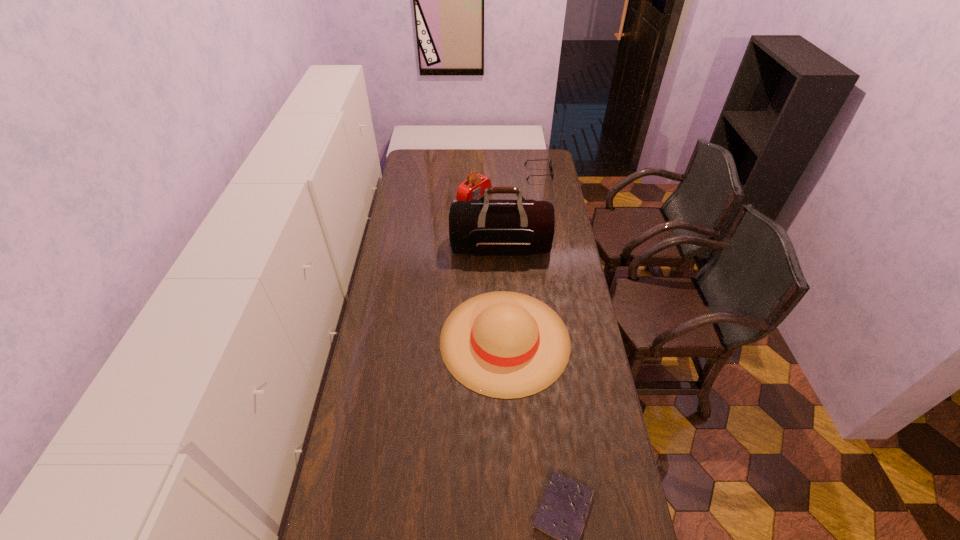
The image size is (960, 540). Identify the location of duffel bag. (483, 227).

Where is `the tallest object`? This screenshot has width=960, height=540. the tallest object is located at coordinates (483, 227).

Find the location of `the second nearest object`. the second nearest object is located at coordinates (502, 344).

You are a GUI agent. You are given a task and a screenshot of the screen. Output one action in this format:
    pyautogui.click(x=<x>, y=<y>)
    Task: Click on the fourth nearest object
    The image size is (960, 540).
    Given the screenshot: What is the action you would take?
    pyautogui.click(x=473, y=188)

Image resolution: width=960 pixels, height=540 pixels. In order to click on the fourth tallest object in this screenshot , I will do `click(551, 168)`.

The image size is (960, 540). I want to click on the farthest object, so click(x=551, y=168).

Locate an element on the screen. vacant position located 0.380m on the front pocket of the duffel bag is located at coordinates (505, 334).

Where is `vacant area located 0.150m on the front of the sombrero`? vacant area located 0.150m on the front of the sombrero is located at coordinates point(510,443).

This screenshot has height=540, width=960. What are the coordinates of `free space located on the back of the toaster` in the screenshot? It's located at (475, 154).

What are the coordinates of `object present at the far edge` in the screenshot? It's located at (551, 168).